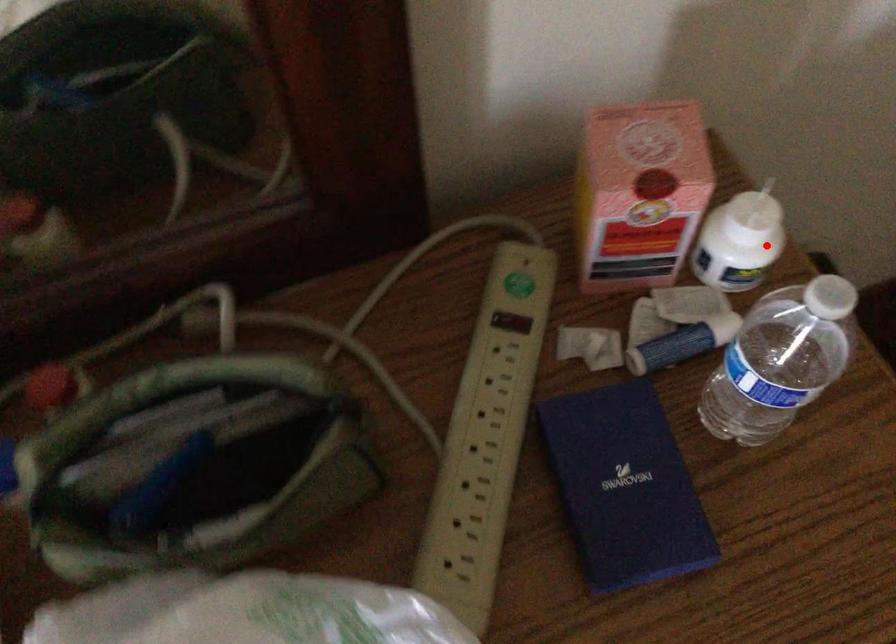
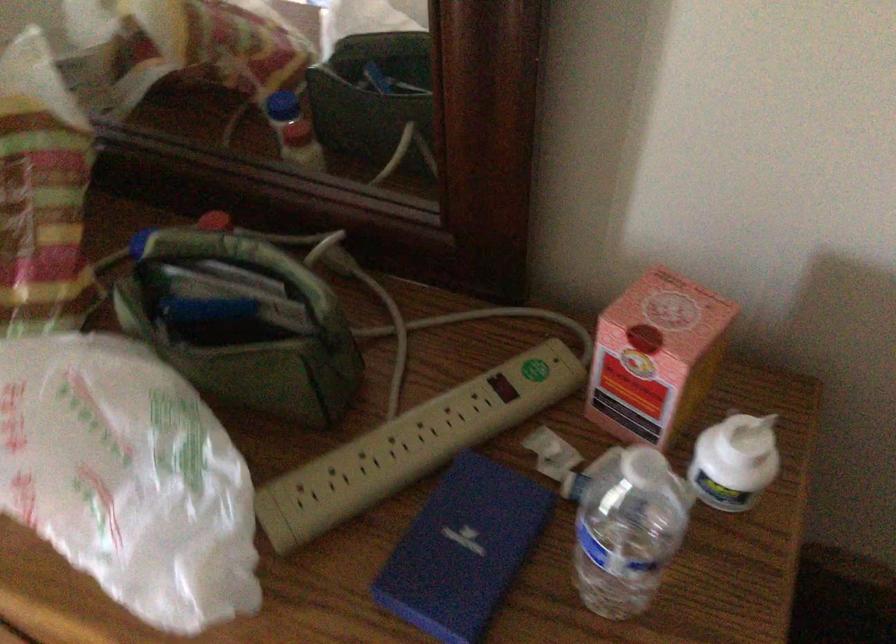
Where in the second image is the point corresponding to the highlighted location from the first image?

(735, 462)